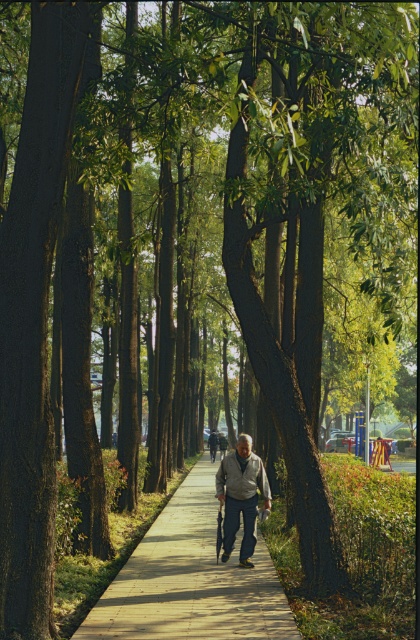
You are a park visitor who wants to know which of the two items takes up more space in the image. You see a gray fabric jacket at center and a dark gray fabric couple at center. Which one requires more area?

The dark gray fabric couple at center requires more area than the gray fabric jacket at center because the gray fabric jacket at center occupies less space than dark gray fabric couple at center.

You are a photographer standing at the park entrance. You want to capture a photo of the gray fabric jacket at center and the dark gray fabric couple at center. Which object is narrower in width?

The gray fabric jacket at center is narrower in width than the dark gray fabric couple at center.

You are a park visitor who wants to place a small potted plant on the wooden boardwalk at center. However, you notice the gray fabric jacket at center is currently occupying that area. Can you place the plant there without disturbing the person?

The wooden boardwalk at center is below gray fabric jacket at center, meaning the jacket is on top of the boardwalk. Since the jacket is being worn by the person, you cannot place the plant there without disturbing them.